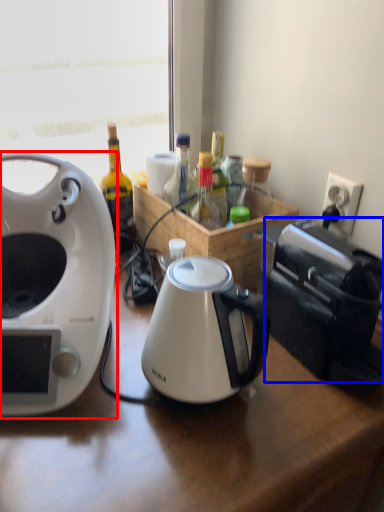
Question: Among these objects, which one is nearest to the camera, coffee maker (highlighted by a red box) or toaster (highlighted by a blue box)?

Choices:
 (A) coffee maker
 (B) toaster

Answer: (A)